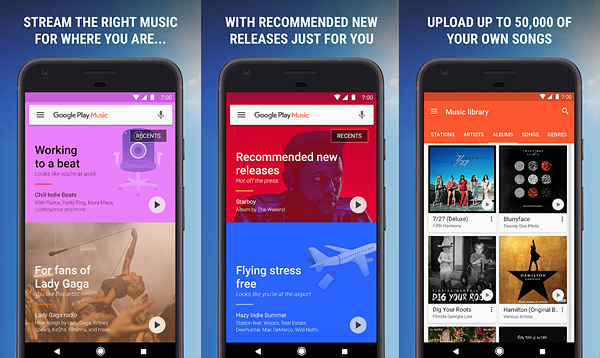
This screenshot has width=600, height=358. I want to click on cartoon chair, so click(x=134, y=161).